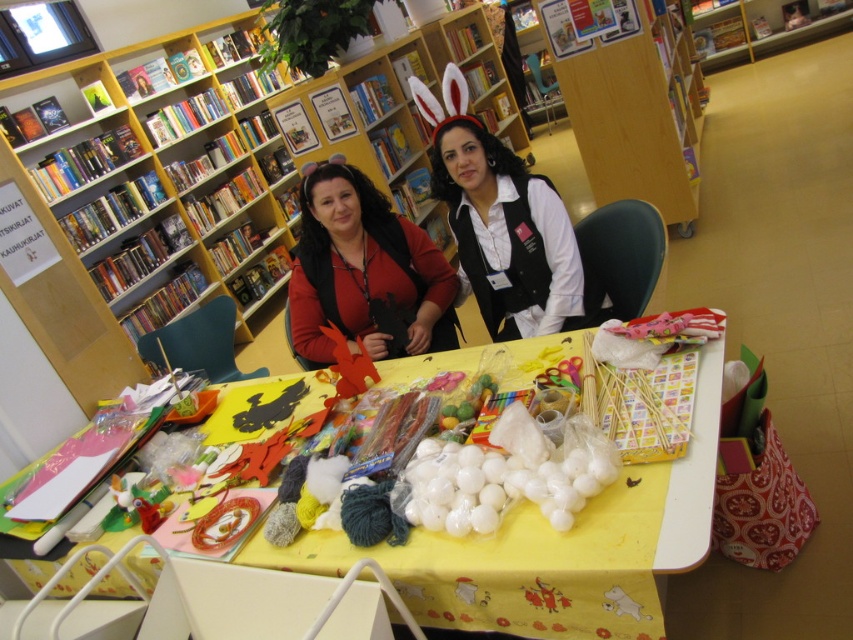
Can you confirm if yellow paper table at center is positioned above black matte vest at center?

No, yellow paper table at center is not above black matte vest at center.

This screenshot has height=640, width=853. Describe the element at coordinates (549, 544) in the screenshot. I see `yellow paper table at center` at that location.

Which is in front, point (448, 611) or point (575, 268)?

Point (448, 611) is in front.

Find the location of a particular element. This screenshot has width=853, height=640. yellow paper table at center is located at coordinates (549, 544).

Which is in front, point (328, 556) or point (354, 289)?

Point (328, 556)

Does point (409, 579) come in front of point (418, 316)?

Yes, it is.

Where is `yellow paper table at center`? The width and height of the screenshot is (853, 640). yellow paper table at center is located at coordinates (549, 544).

Is point (479, 218) farther from camera compared to point (395, 332)?

No, (479, 218) is in front of (395, 332).

Does black matte vest at center have a greater width compared to matte red sweater at center?

Correct, the width of black matte vest at center exceeds that of matte red sweater at center.

Which is behind, point (494, 209) or point (364, 305)?

The point (364, 305) is behind.

Where is `black matte vest at center`? black matte vest at center is located at coordinates (505, 225).